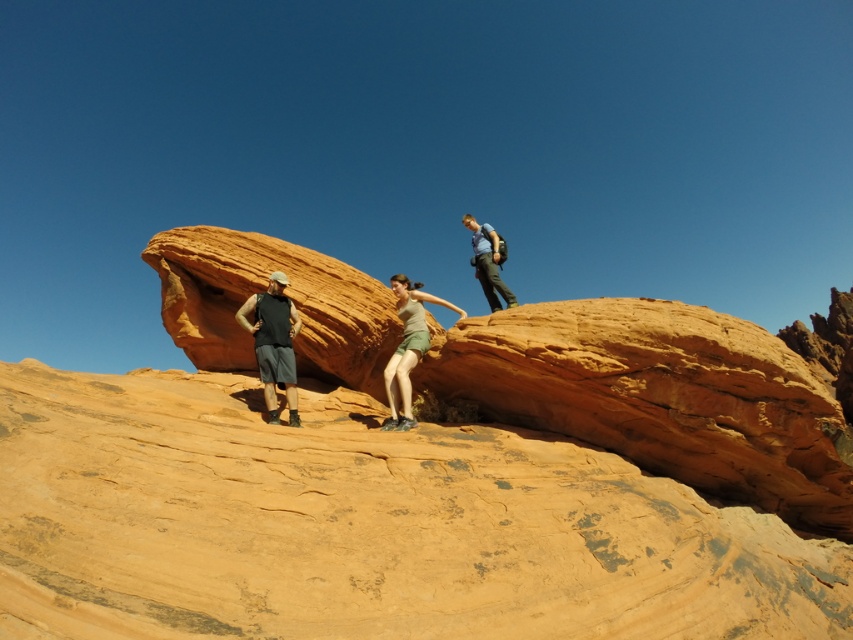
Is matte black tank top at center shorter than matte blue shirt at upper center?

No, matte black tank top at center is not shorter than matte blue shirt at upper center.

Image resolution: width=853 pixels, height=640 pixels. What do you see at coordinates (273, 342) in the screenshot?
I see `matte black tank top at center` at bounding box center [273, 342].

Measure the distance between matte black tank top at center and camera.

matte black tank top at center is 219.39 feet from camera.

Identify the location of matte black tank top at center. (273, 342).

Does matte green shorts at center lie in front of matte blue shirt at upper center?

Yes, it is.

Does matte green shorts at center have a greater width compared to matte blue shirt at upper center?

Yes, matte green shorts at center is wider than matte blue shirt at upper center.

Between point (421, 307) and point (476, 256), which one is positioned behind?

The point (476, 256) is more distant.

Locate an element on the screen. matte green shorts at center is located at coordinates (407, 348).

Does matte black tank top at center have a smaller size compared to matte green shorts at center?

Correct, matte black tank top at center occupies less space than matte green shorts at center.

Can you confirm if matte black tank top at center is wider than matte green shorts at center?

Incorrect, matte black tank top at center's width does not surpass matte green shorts at center's.

Locate an element on the screen. The image size is (853, 640). matte black tank top at center is located at coordinates (273, 342).

Find the location of a particular element. This screenshot has height=640, width=853. matte black tank top at center is located at coordinates (273, 342).